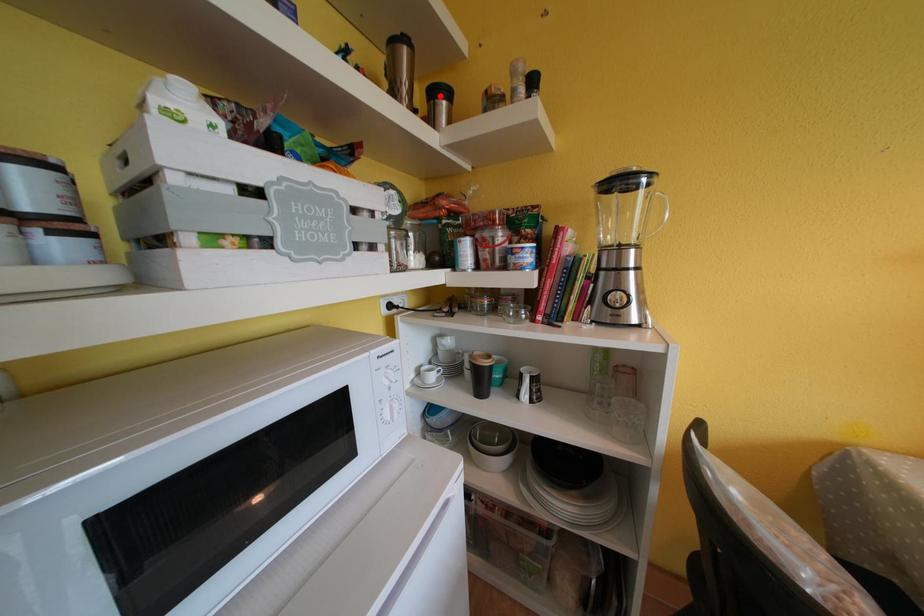
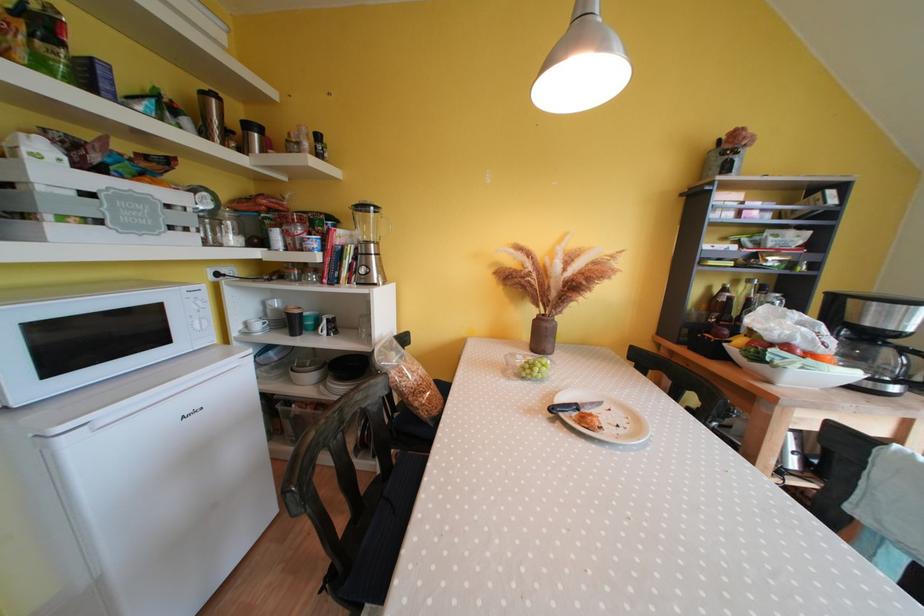
In the second image, find the point that corresponds to the highlighted location in the first image.

(252, 130)